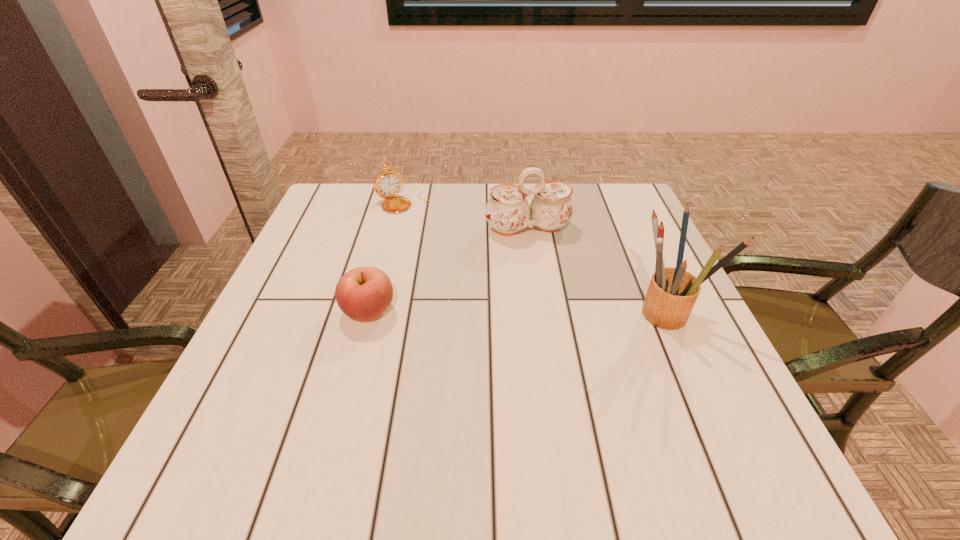
Locate an element on the screen. This screenshot has height=540, width=960. vacant space that satisfies the following two spatial constraints: 1. on the front side of the second tallest object; 2. on the right side of the rightmost object is located at coordinates (540, 312).

The width and height of the screenshot is (960, 540). I want to click on vacant space that satisfies the following two spatial constraints: 1. on the front side of the pocket watch; 2. on the right side of the chinaware, so click(x=396, y=228).